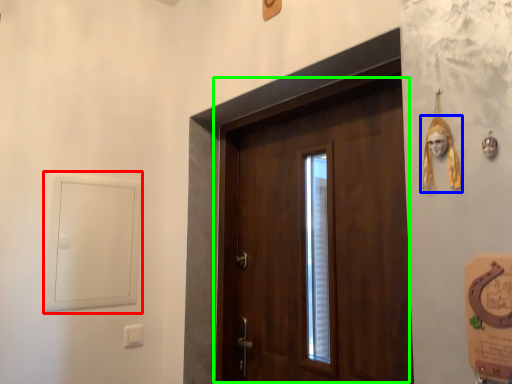
Question: Which is farther away from window (highlighted by a red box)? skull (highlighted by a blue box) or door (highlighted by a green box)?

Choices:
 (A) skull
 (B) door

Answer: (A)